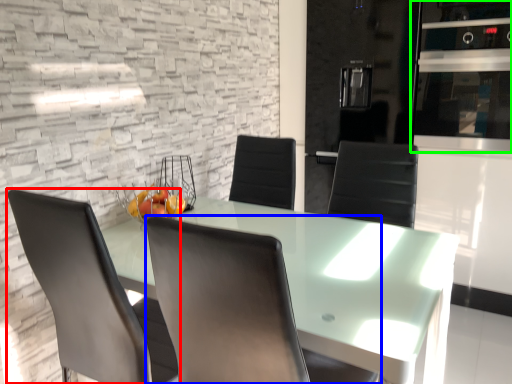
Question: Which object is positioned closest to chair (highlighted by a red box)? Select from chair (highlighted by a blue box) and appliance (highlighted by a green box).

Choices:
 (A) chair
 (B) appliance

Answer: (A)